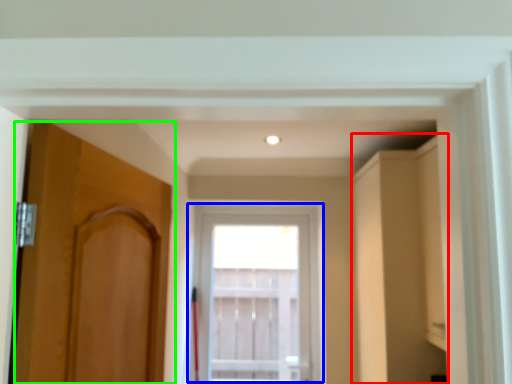
Question: Estimate the real-world distances between objects in this image. Which object is closer to cabinetry (highlighted by a red box), window (highlighted by a blue box) or door (highlighted by a green box)?

Choices:
 (A) window
 (B) door

Answer: (B)